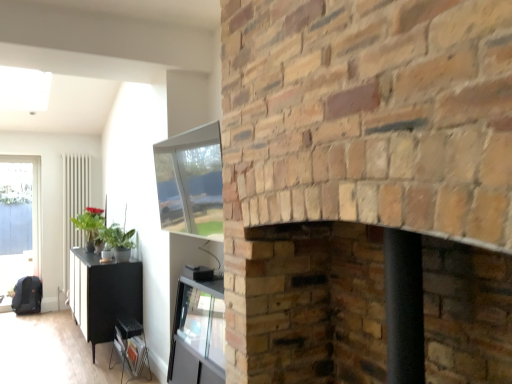
Question: From a real-world perspective, is smooth brick fireplace at center, which ranks as the 1th fireplace in bottom-to-top order, positioned over brick fireplace at center, the second fireplace ordered from the bottom, based on gravity?

Choices:
 (A) yes
 (B) no

Answer: (B)

Question: Is smooth brick fireplace at center, which ranks as the 1th fireplace in bottom-to-top order, at the left side of brick fireplace at center, the second fireplace ordered from the bottom?

Choices:
 (A) no
 (B) yes

Answer: (A)

Question: Is smooth brick fireplace at center, which ranks as the 1th fireplace in bottom-to-top order, touching brick fireplace at center, the second fireplace ordered from the bottom?

Choices:
 (A) no
 (B) yes

Answer: (A)

Question: Considering the relative sizes of smooth brick fireplace at center, acting as the second fireplace starting from the top, and brick fireplace at center, arranged as the first fireplace when viewed from the top, in the image provided, is smooth brick fireplace at center, acting as the second fireplace starting from the top, taller than brick fireplace at center, arranged as the first fireplace when viewed from the top,?

Choices:
 (A) yes
 (B) no

Answer: (B)

Question: Is smooth brick fireplace at center, acting as the second fireplace starting from the top, aimed at brick fireplace at center, arranged as the first fireplace when viewed from the top?

Choices:
 (A) no
 (B) yes

Answer: (B)

Question: Can you confirm if smooth brick fireplace at center, acting as the second fireplace starting from the top, is wider than brick fireplace at center, arranged as the first fireplace when viewed from the top?

Choices:
 (A) no
 (B) yes

Answer: (A)

Question: Considering the relative sizes of brick fireplace at center, arranged as the first fireplace when viewed from the top, and green matte plant at left in the image provided, is brick fireplace at center, arranged as the first fireplace when viewed from the top, shorter than green matte plant at left?

Choices:
 (A) yes
 (B) no

Answer: (B)

Question: Can you confirm if brick fireplace at center, arranged as the first fireplace when viewed from the top, is wider than green matte plant at left?

Choices:
 (A) yes
 (B) no

Answer: (A)

Question: Is green matte plant at left a part of brick fireplace at center, arranged as the first fireplace when viewed from the top?

Choices:
 (A) no
 (B) yes

Answer: (A)

Question: Considering the relative sizes of brick fireplace at center, arranged as the first fireplace when viewed from the top, and green matte plant at left in the image provided, is brick fireplace at center, arranged as the first fireplace when viewed from the top, bigger than green matte plant at left?

Choices:
 (A) no
 (B) yes

Answer: (B)

Question: From the image's perspective, would you say brick fireplace at center, arranged as the first fireplace when viewed from the top, is positioned over green matte plant at left?

Choices:
 (A) no
 (B) yes

Answer: (B)

Question: Is brick fireplace at center, arranged as the first fireplace when viewed from the top, beside green matte plant at left?

Choices:
 (A) no
 (B) yes

Answer: (A)

Question: From the image's perspective, is green matte plant at left above brick fireplace at center, the second fireplace ordered from the bottom?

Choices:
 (A) yes
 (B) no

Answer: (B)